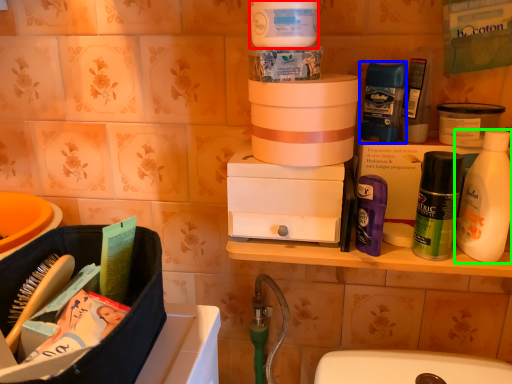
Question: Estimate the real-world distances between objects in this image. Which object is farther from cleaning product (highlighted by a red box), toiletry (highlighted by a blue box) or bottle (highlighted by a green box)?

Choices:
 (A) toiletry
 (B) bottle

Answer: (B)